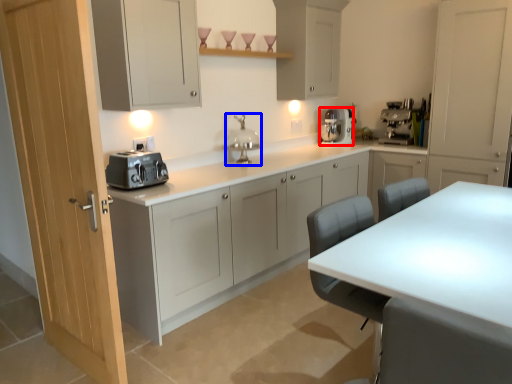
Question: Among these objects, which one is farthest to the camera, kitchen appliance (highlighted by a red box) or faucet (highlighted by a blue box)?

Choices:
 (A) kitchen appliance
 (B) faucet

Answer: (A)